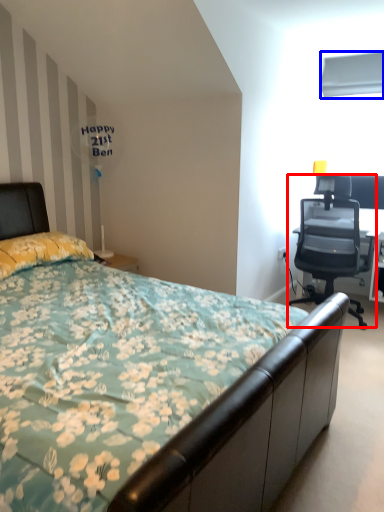
Question: Which of the following is the farthest to the observer, chair (highlighted by a red box) or window screen (highlighted by a blue box)?

Choices:
 (A) chair
 (B) window screen

Answer: (B)